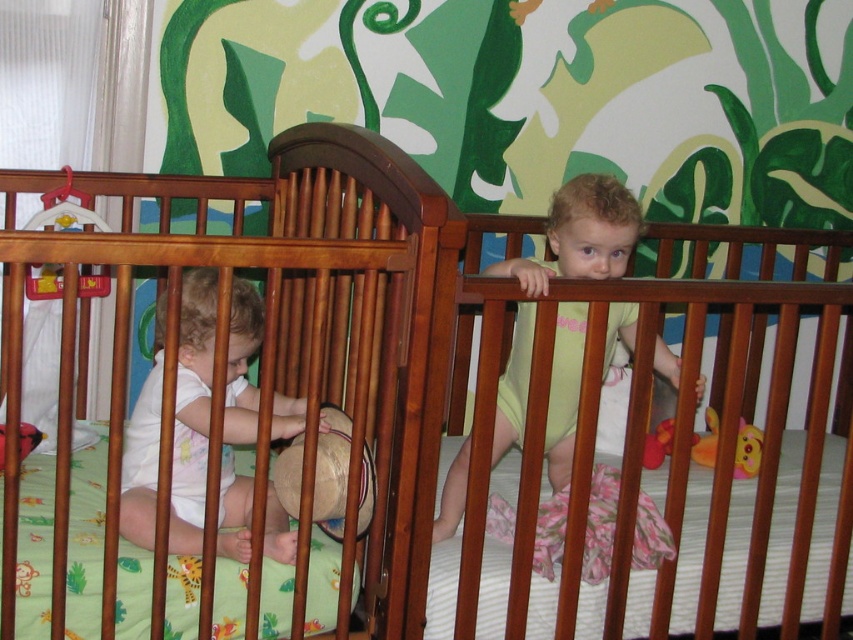
Question: Is wooden crib at right smaller than white cotton toddler at left?

Choices:
 (A) no
 (B) yes

Answer: (A)

Question: Estimate the real-world distances between objects in this image. Which object is closer to the yellow plush duck at center?

Choices:
 (A) white cotton toddler at left
 (B) wooden crib at left
 (C) wooden crib at right

Answer: (C)

Question: Which point is closer to the camera?

Choices:
 (A) (668, 500)
 (B) (498, 449)
 (C) (715, 435)
 (D) (651, 460)

Answer: (A)

Question: Observing the image, what is the correct spatial positioning of wooden crib at left in reference to wooden crib at right?

Choices:
 (A) right
 (B) left

Answer: (B)

Question: Can you confirm if white cotton toddler at left is thinner than light yellow fabric toddler at upper right?

Choices:
 (A) no
 (B) yes

Answer: (B)

Question: Which object is positioned closest to the light yellow fabric toddler at upper right?

Choices:
 (A) wooden crib at left
 (B) rubber duck at center
 (C) yellow plush duck at center
 (D) white cotton toddler at left

Answer: (A)